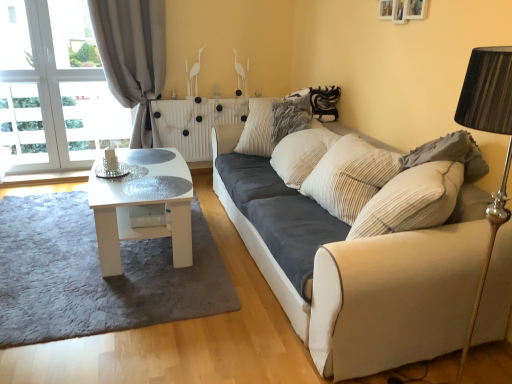
Identify the location of free space to the left of white glossy coffee table at center. (55, 228).